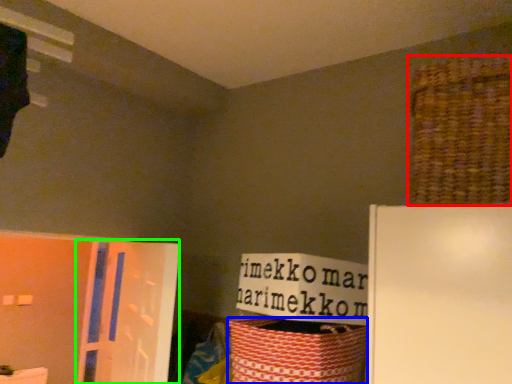
Question: Based on their relative distances, which object is farther from basket (highlighted by a red box)? Choose from basket (highlighted by a blue box) and screen door (highlighted by a green box).

Choices:
 (A) basket
 (B) screen door

Answer: (B)